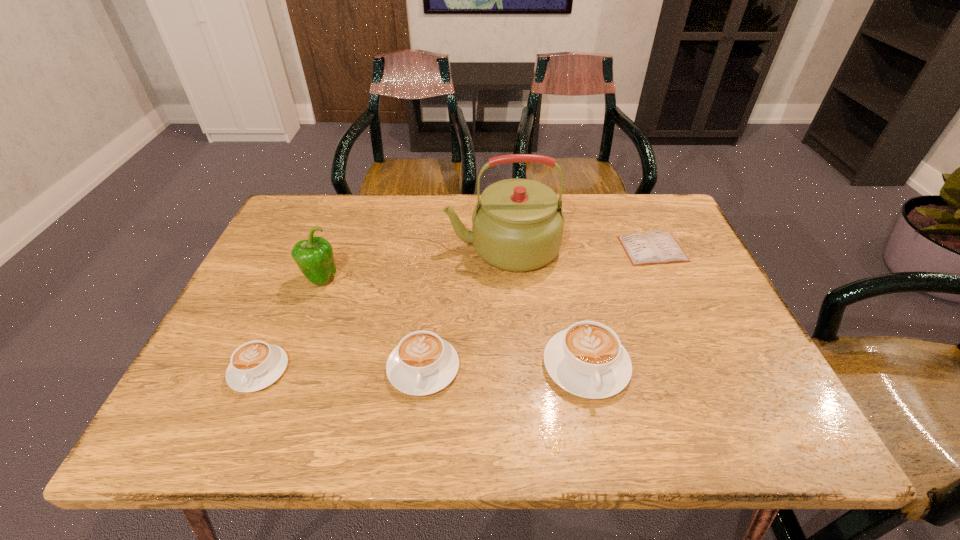
Locate an element on the screen. free space for a new cappuccino on the right is located at coordinates (748, 363).